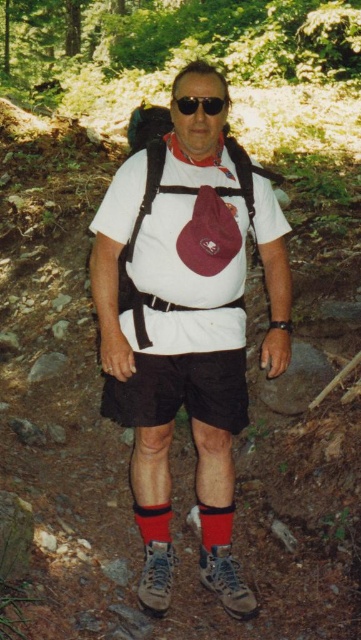
Which is below, white matte t-shirt at center or black matte sunglasses at center?

white matte t-shirt at center is lower down.

Can you confirm if white matte t-shirt at center is positioned above black matte sunglasses at center?

Actually, white matte t-shirt at center is below black matte sunglasses at center.

You are a GUI agent. You are given a task and a screenshot of the screen. Output one action in this format:
    pyautogui.click(x=<x>, y=<y>)
    Task: Click on the white matte t-shirt at center
    The image size is (361, 640).
    Given the screenshot: What is the action you would take?
    pyautogui.click(x=186, y=323)

Identify the location of white matte t-shirt at center. (186, 323).

Between white matte t-shirt at center and black cotton shorts at center, which one appears on the right side from the viewer's perspective?

white matte t-shirt at center

Looking at this image, is white matte t-shirt at center thinner than black cotton shorts at center?

Incorrect, white matte t-shirt at center's width is not less than black cotton shorts at center's.

Who is more forward, (193,244) or (201,388)?

Point (193,244)

This screenshot has height=640, width=361. Identify the location of white matte t-shirt at center. (186, 323).

Can you confirm if black cotton shorts at center is positioned to the left of black matte sunglasses at center?

Correct, you'll find black cotton shorts at center to the left of black matte sunglasses at center.

Is point (220, 406) positioned after point (222, 104)?

Yes, point (220, 406) is farther from viewer.

Does point (155, 406) lie behind point (199, 104)?

Yes, point (155, 406) is farther from viewer.

Where is `black cotton shorts at center`? This screenshot has width=361, height=640. black cotton shorts at center is located at coordinates (180, 390).